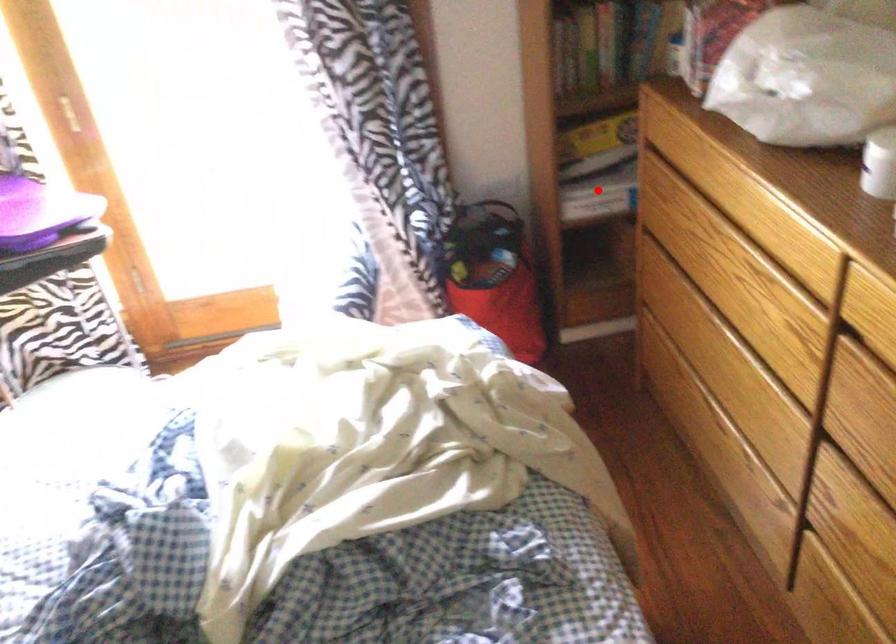
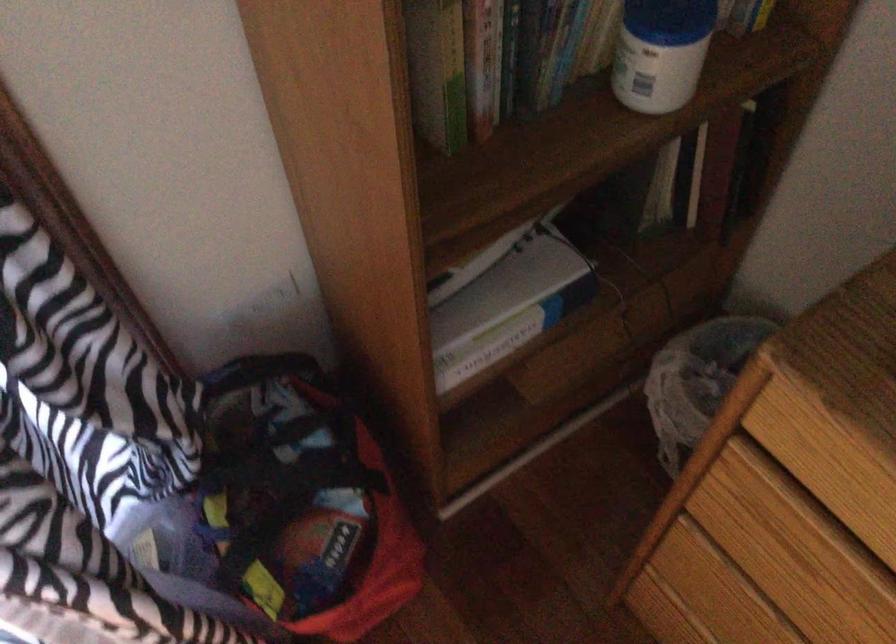
Find the pixel in the second image that matches the highlighted location in the first image.

(495, 345)